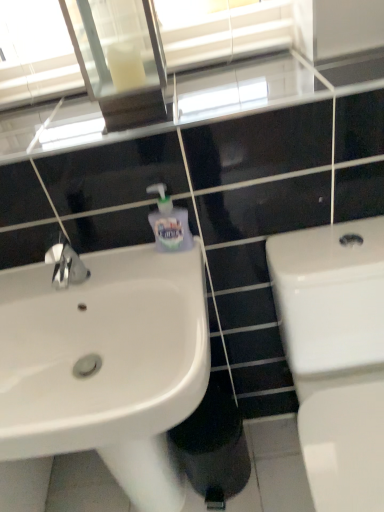
Locate an element on the screen. free spot in front of translucent plastic soap dispenser at upper center is located at coordinates (173, 274).